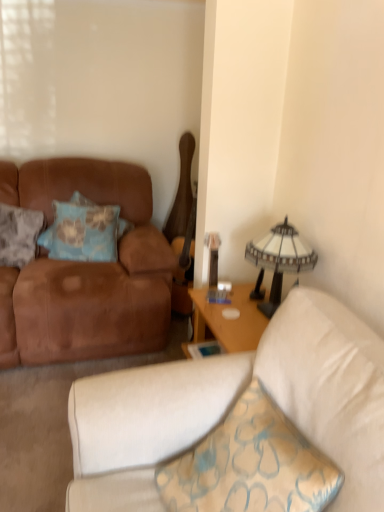
Question: Considering the positions of white glass lampshade at upper right and textured blue pillow at left, positioned as the first pillow in left-to-right order, in the image, is white glass lampshade at upper right wider or thinner than textured blue pillow at left, positioned as the first pillow in left-to-right order,?

Choices:
 (A) wide
 (B) thin

Answer: (B)

Question: From the image's perspective, relative to textured blue pillow at left, positioned as the first pillow in left-to-right order, is white glass lampshade at upper right above or below?

Choices:
 (A) above
 (B) below

Answer: (B)

Question: Estimate the real-world distances between objects in this image. Which object is farther from the blue fabric pillow at left, arranged as the 1th pillow when viewed from the right?

Choices:
 (A) suede brown couch at left, the 1th studio couch viewed from the front
 (B) textured blue pillow at left, positioned as the first pillow in left-to-right order
 (C) white glass lampshade at upper right
 (D) brown suede couch at left, the 1th studio couch when ordered from back to front

Answer: (A)

Question: Considering the real-world distances, which object is farthest from the suede brown couch at left, the 1th studio couch viewed from the front?

Choices:
 (A) textured blue pillow at left, the 2th pillow when ordered from right to left
 (B) brown suede couch at left, the 1th studio couch when ordered from back to front
 (C) blue fabric pillow at left, arranged as the 1th pillow when viewed from the right
 (D) white glass lampshade at upper right

Answer: (A)